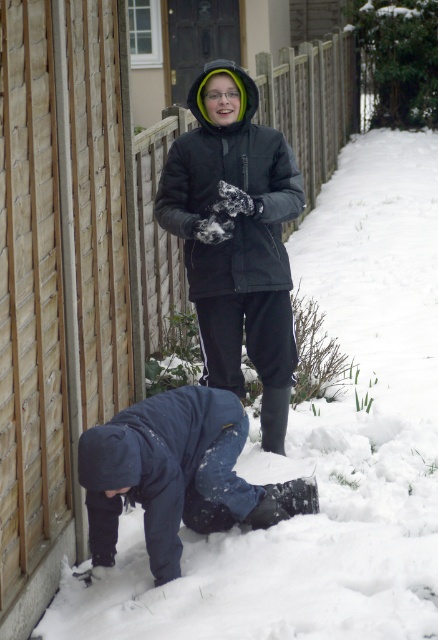
You are a photographer trying to capture the scene from the left side of the image. You notice the matte black jacket at center and the dark blue fabric at lower center. Which object should you focus on first if you want to include both in your shot without moving the camera?

The dark blue fabric at lower center should be focused on first because it is closer to the left side of the image compared to the matte black jacket at center, which is positioned to its right.